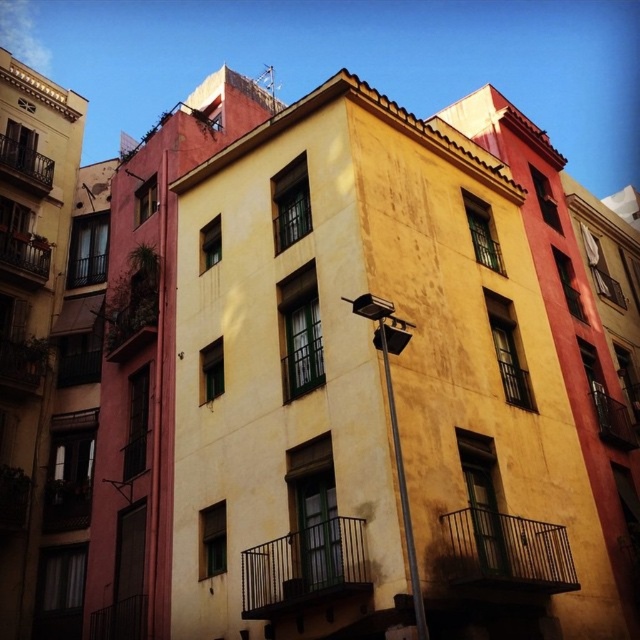
At what (x,y) coordinates should I click in order to perform the action: click on metallic pole at center. Please return your answer as a coordinate pair (x, y). This screenshot has width=640, height=640. Looking at the image, I should click on (394, 422).

Is point (396, 339) less distant than point (596, 408)?

Yes, point (396, 339) is in front of point (596, 408).

Which is behind, point (406, 547) or point (625, 448)?

Point (625, 448)

I want to click on metallic pole at center, so click(x=394, y=422).

Can you confirm if rustic wood balcony at left is positioned to the right of metallic black balcony at right?

No, rustic wood balcony at left is not to the right of metallic black balcony at right.

Between point (4, 260) and point (616, 442), which one is positioned in front?

Point (616, 442)

Does point (29, 269) come behind point (602, 428)?

Yes.

At what (x,y) coordinates should I click in order to perform the action: click on rustic wood balcony at left. Please return your answer as a coordinate pair (x, y). Image resolution: width=640 pixels, height=640 pixels. Looking at the image, I should click on (24, 256).

Can you confirm if metallic black balcony at lower right is positioned below metallic pole at center?

Yes.

Image resolution: width=640 pixels, height=640 pixels. Find the location of `metallic black balcony at lower right`. metallic black balcony at lower right is located at coordinates (506, 550).

Find the location of a particular element. The width and height of the screenshot is (640, 640). metallic black balcony at lower right is located at coordinates (506, 550).